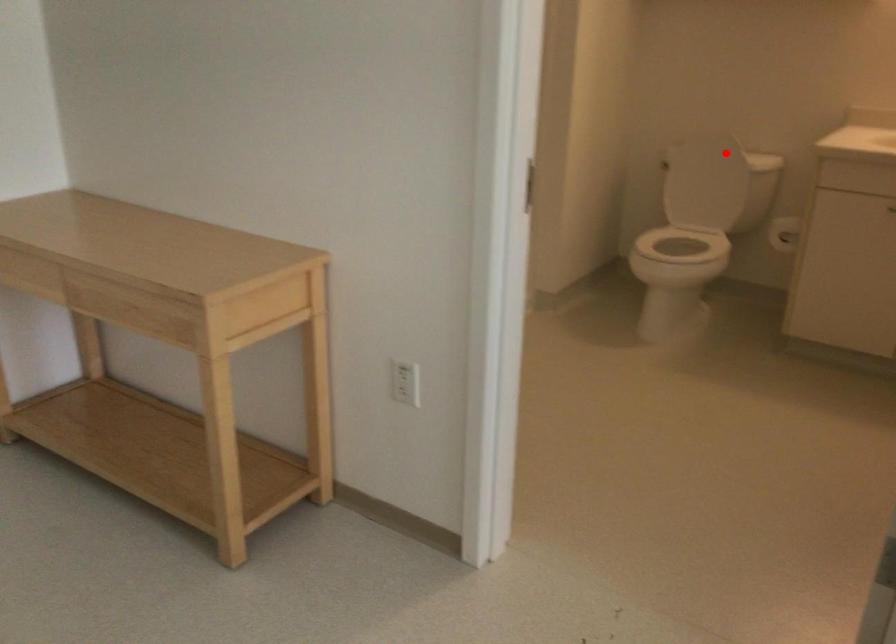
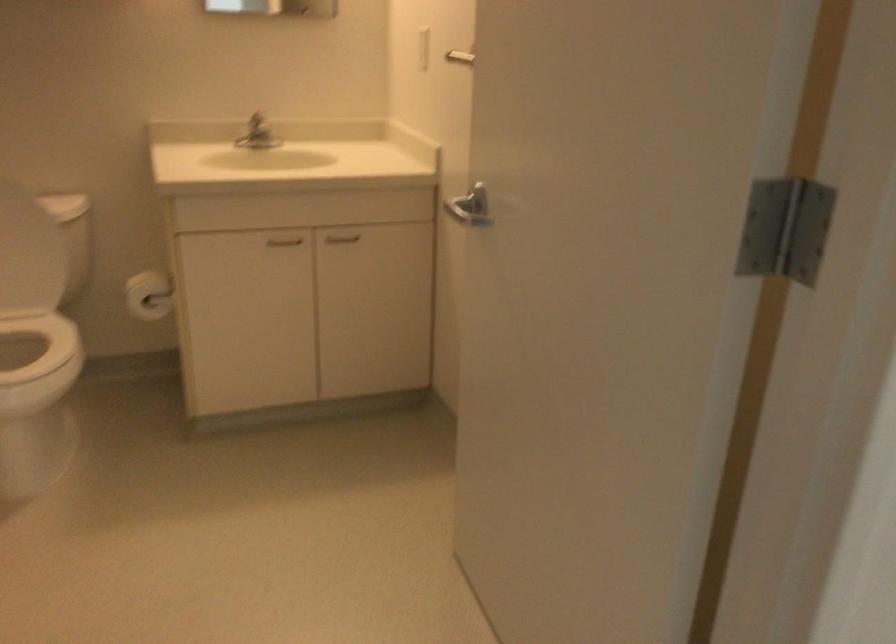
Locate, in the second image, the point that corresponds to the highlighted location in the first image.

(12, 210)